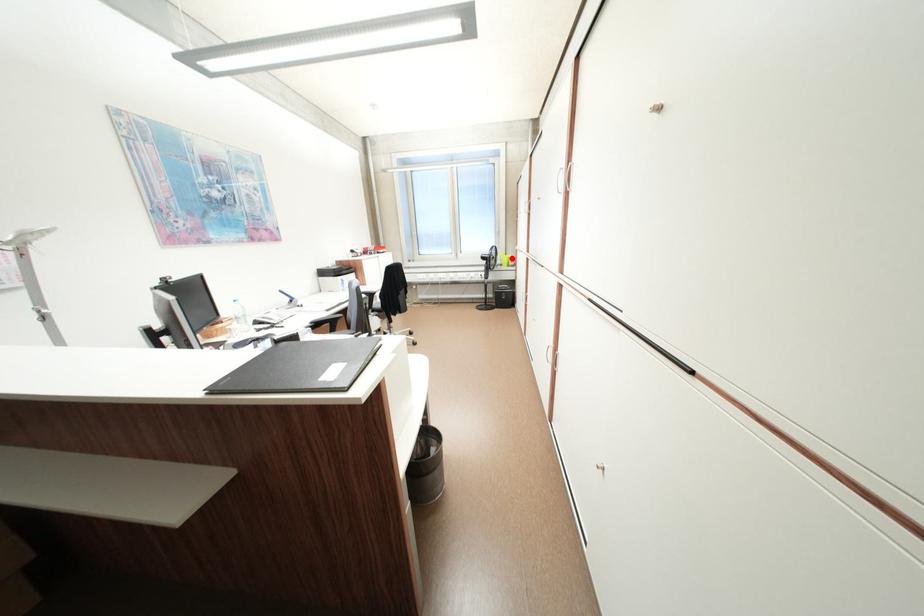
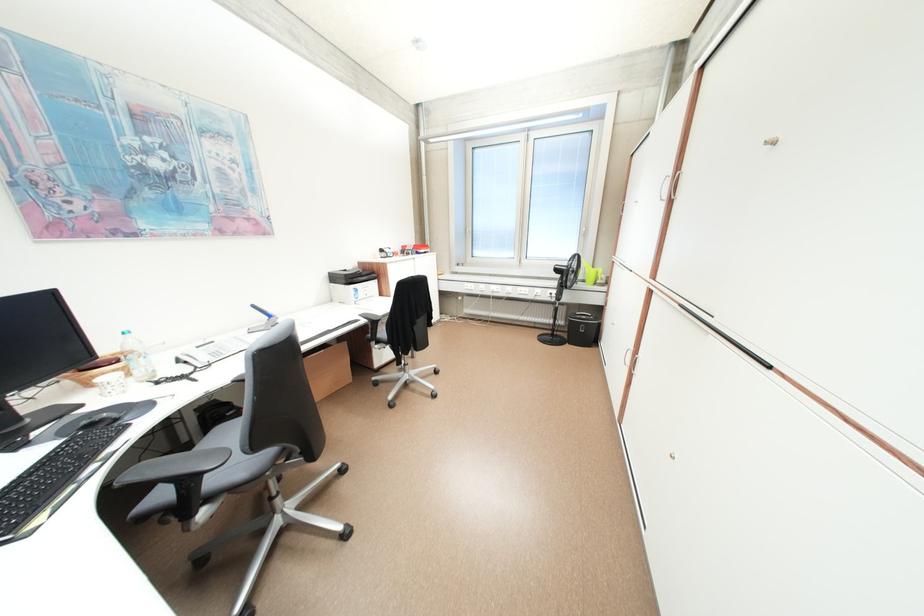
The point at the highlighted location is marked in the first image. Where is the corresponding point in the second image?

(598, 273)